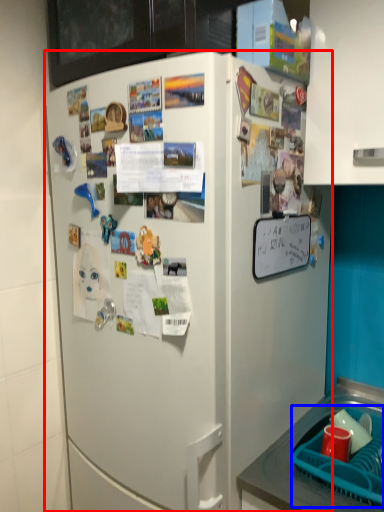
Question: Among these objects, which one is farthest to the camera, refrigerator (highlighted by a red box) or basket (highlighted by a blue box)?

Choices:
 (A) refrigerator
 (B) basket

Answer: (B)